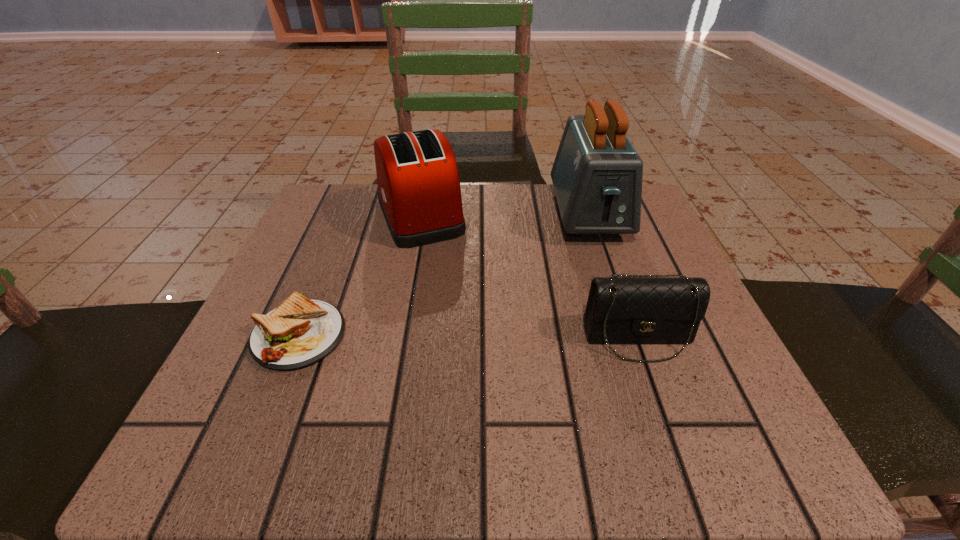
Where is `toaster that is at the left edge`? This screenshot has width=960, height=540. toaster that is at the left edge is located at coordinates (419, 192).

I want to click on sandwich present at the left edge, so click(300, 332).

This screenshot has height=540, width=960. What are the coordinates of `toaster that is at the right edge` in the screenshot? It's located at click(597, 174).

Where is `clutch bag situated at the right edge`? The height and width of the screenshot is (540, 960). clutch bag situated at the right edge is located at coordinates tap(631, 309).

I want to click on object that is at the far left corner, so click(x=419, y=192).

Locate an element on the screen. object that is at the far right corner is located at coordinates (597, 174).

In the image, there is a desktop. Where is `vacant space at the far edge`? vacant space at the far edge is located at coordinates (507, 187).

In the image, there is a desktop. Where is `free space at the near edge`? Image resolution: width=960 pixels, height=540 pixels. free space at the near edge is located at coordinates (530, 426).

In the image, there is a desktop. Where is `free space at the left edge`? The width and height of the screenshot is (960, 540). free space at the left edge is located at coordinates (353, 247).

Find the location of a particular element. The width and height of the screenshot is (960, 540). vacant point at the right edge is located at coordinates (713, 392).